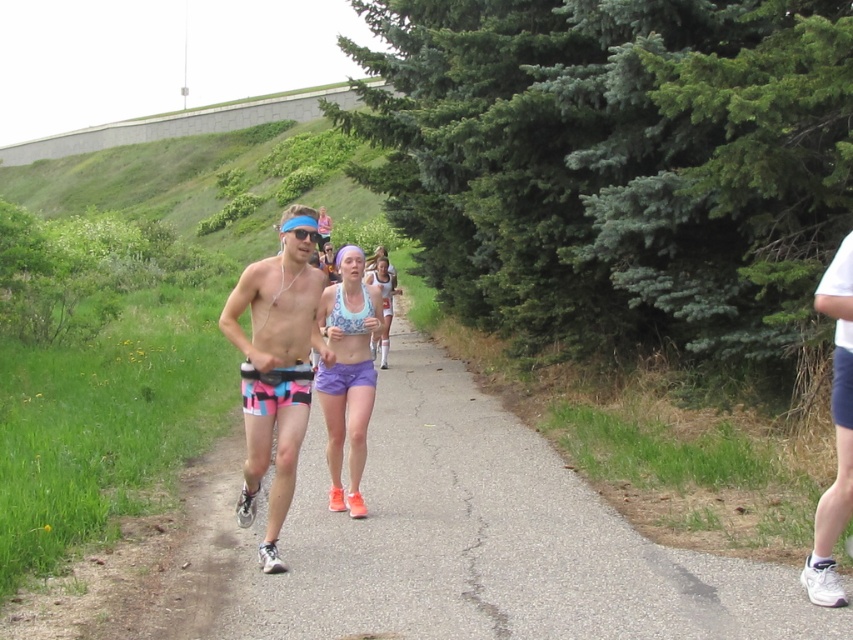
You are a photographer positioned at the starting line of the race. You want to capture a photo of both the purple fabric shorts at center and the white cotton shirt at right in the same frame. Which runner should you focus on to include both?

You should focus on the purple fabric shorts at center because the white cotton shirt at right is behind it, meaning both will be visible in the same frame when the photographer focuses on the front runner.

You are a photographer positioned at the starting line of the race. You want to capture a photo of both the matte blue tank top at center and the white matte bikini top at center in the same frame. Based on their positions, which runner is closer to the camera?

The matte blue tank top at center is closer to the camera because it is positioned in front of the white matte bikini top at center.